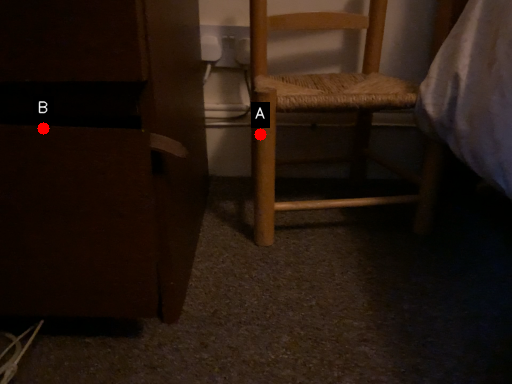
Question: Two points are circled on the image, labeled by A and B beside each circle. Which point is further to the camera?

Choices:
 (A) A is further
 (B) B is further

Answer: (A)